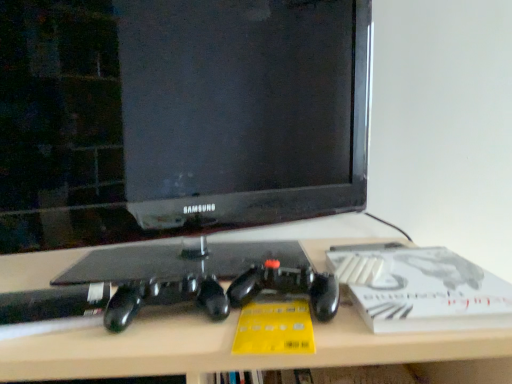
Question: Does white matte paperback book at right have a lesser width compared to matte black desk at center?

Choices:
 (A) yes
 (B) no

Answer: (A)

Question: Is white matte paperback book at right to the right of matte black desk at center from the viewer's perspective?

Choices:
 (A) yes
 (B) no

Answer: (A)

Question: Is the surface of white matte paperback book at right in direct contact with matte black desk at center?

Choices:
 (A) no
 (B) yes

Answer: (A)

Question: From a real-world perspective, does white matte paperback book at right sit lower than matte black desk at center?

Choices:
 (A) yes
 (B) no

Answer: (B)

Question: Is white matte paperback book at right shorter than matte black desk at center?

Choices:
 (A) yes
 (B) no

Answer: (A)

Question: Is white matte paperback book at right smaller than matte black desk at center?

Choices:
 (A) no
 (B) yes

Answer: (B)

Question: Would you consider black glossy monitor at center to be distant from white matte paperback book at right?

Choices:
 (A) yes
 (B) no

Answer: (B)

Question: Considering the relative sizes of black glossy monitor at center and white matte paperback book at right in the image provided, is black glossy monitor at center smaller than white matte paperback book at right?

Choices:
 (A) no
 (B) yes

Answer: (A)

Question: Would you say black glossy monitor at center contains white matte paperback book at right?

Choices:
 (A) yes
 (B) no

Answer: (B)

Question: Is the position of black glossy monitor at center more distant than that of white matte paperback book at right?

Choices:
 (A) no
 (B) yes

Answer: (B)

Question: Is black glossy monitor at center touching white matte paperback book at right?

Choices:
 (A) no
 (B) yes

Answer: (A)

Question: Considering the relative positions of black glossy monitor at center and white matte paperback book at right in the image provided, is black glossy monitor at center in front of white matte paperback book at right?

Choices:
 (A) yes
 (B) no

Answer: (B)

Question: Is white matte paperback book at right not inside black glossy monitor at center?

Choices:
 (A) no
 (B) yes

Answer: (B)